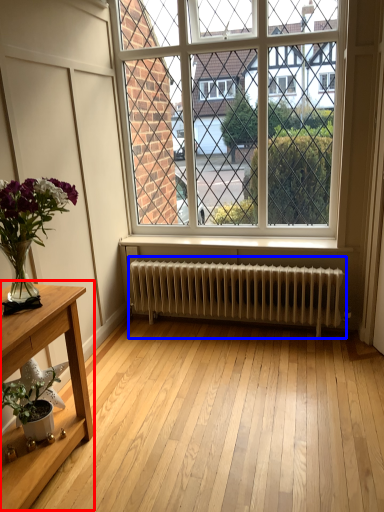
Question: Which object appears closest to the camera in this image, table (highlighted by a red box) or radiator (highlighted by a blue box)?

Choices:
 (A) table
 (B) radiator

Answer: (A)